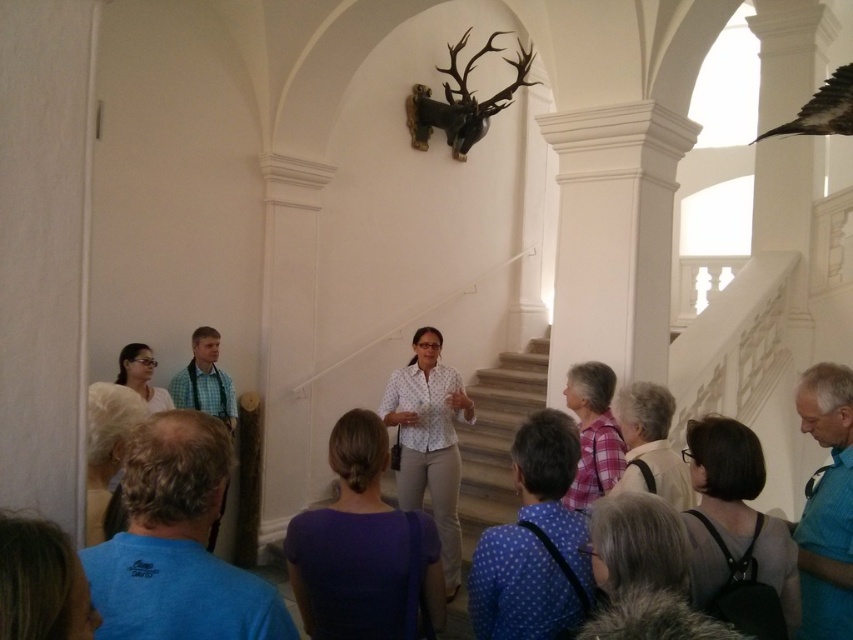
Can you confirm if blue t-shirt at lower left is positioned to the left of white dotted shirt at center?

Indeed, blue t-shirt at lower left is positioned on the left side of white dotted shirt at center.

Can you confirm if blue t-shirt at lower left is bigger than white dotted shirt at center?

No.

You are a GUI agent. You are given a task and a screenshot of the screen. Output one action in this format:
    pyautogui.click(x=<x>, y=<y>)
    Task: Click on the blue t-shirt at lower left
    The width and height of the screenshot is (853, 640).
    Given the screenshot: What is the action you would take?
    pyautogui.click(x=177, y=545)

Is blue t-shirt at lower left wider than green checkered shirt at center?

Yes, blue t-shirt at lower left is wider than green checkered shirt at center.

Is blue t-shirt at lower left thinner than green checkered shirt at center?

No, blue t-shirt at lower left is not thinner than green checkered shirt at center.

Image resolution: width=853 pixels, height=640 pixels. I want to click on blue t-shirt at lower left, so click(x=177, y=545).

Can you confirm if white dotted shirt at center is shorter than green checkered shirt at center?

Incorrect, white dotted shirt at center's height does not fall short of green checkered shirt at center's.

Which is above, white dotted shirt at center or green checkered shirt at center?

green checkered shirt at center is above.

This screenshot has width=853, height=640. Identify the location of white dotted shirt at center. (428, 442).

Find the location of `white dotted shirt at center`. white dotted shirt at center is located at coordinates (428, 442).